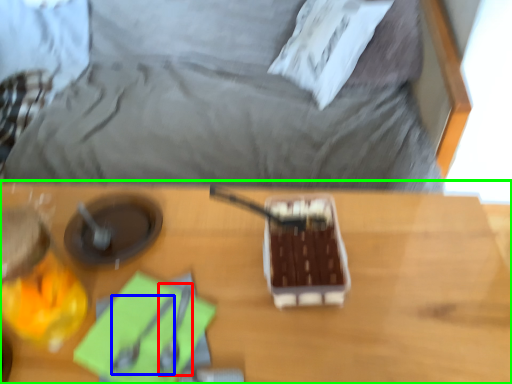
Question: Considering the real-world distances, which object is closest to utensil (highlighted by a red box)? utensil (highlighted by a blue box) or table (highlighted by a green box).

Choices:
 (A) utensil
 (B) table

Answer: (A)